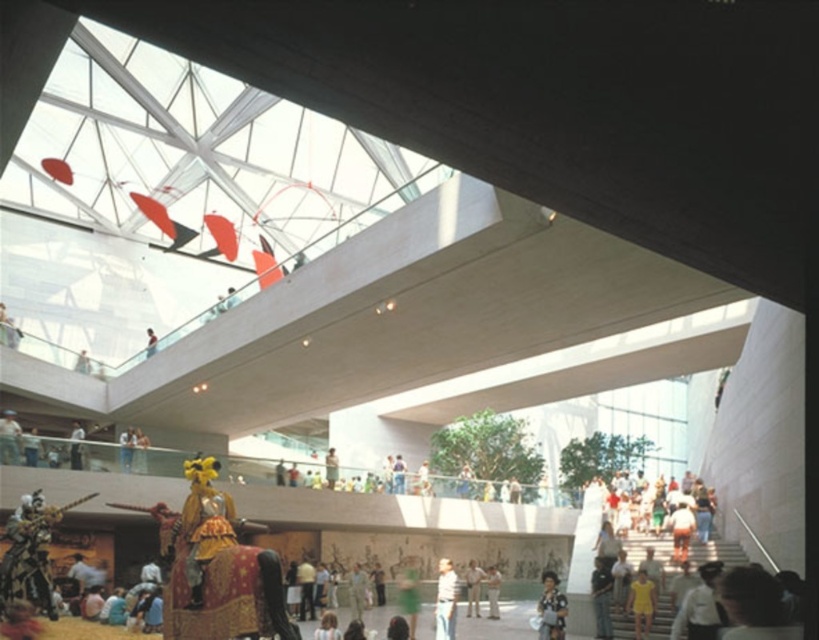
Which is more to the left, white shirt at lower right or light brown leather jacket at lower left?

light brown leather jacket at lower left is more to the left.

Which is behind, point (708, 563) or point (71, 460)?

Point (71, 460)

Locate an element on the screen. This screenshot has width=819, height=640. white shirt at lower right is located at coordinates (700, 605).

Based on the photo, can you confirm if light brown leather jacket at center is thinner than green fabric dress at center?

Yes.

Who is more distant from viewer, (473, 589) or (495, 579)?

Point (495, 579)

Is point (473, 600) closer to camera compared to point (492, 602)?

No, (473, 600) is behind (492, 602).

Identify the location of light brown leather jacket at center. The image size is (819, 640). (473, 588).

Is white shirt at lower right to the right of patterned fabric dress at lower center from the viewer's perspective?

Correct, you'll find white shirt at lower right to the right of patterned fabric dress at lower center.

You are a GUI agent. You are given a task and a screenshot of the screen. Output one action in this format:
    pyautogui.click(x=<x>, y=<y>)
    Task: Click on the white shirt at lower right
    The image size is (819, 640).
    Given the screenshot: What is the action you would take?
    pyautogui.click(x=700, y=605)

You are a GUI agent. You are given a task and a screenshot of the screen. Output one action in this format:
    pyautogui.click(x=<x>, y=<y>)
    Task: Click on the white shirt at lower right
    This screenshot has height=640, width=819.
    Given the screenshot: What is the action you would take?
    pos(700,605)